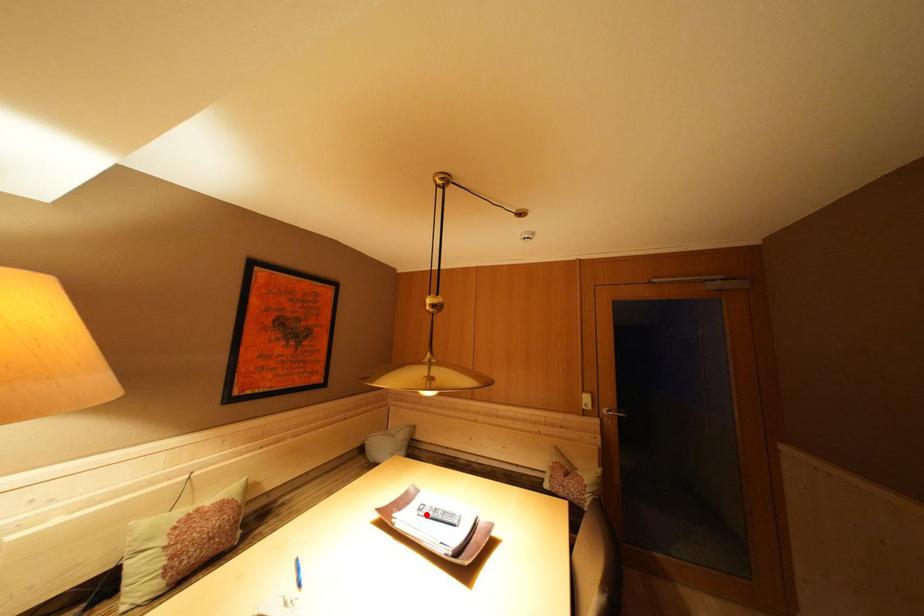
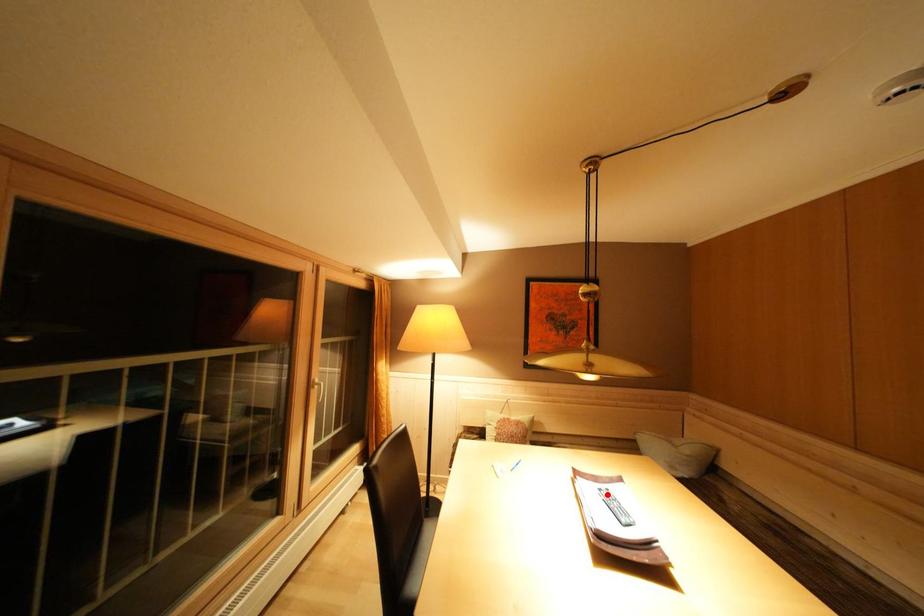
I am providing you with two images of the same scene from different viewpoints. A red point is marked on the first image and another point is marked on the second image. Does the point marked in image1 correspond to the same location as the one in image2?

Yes